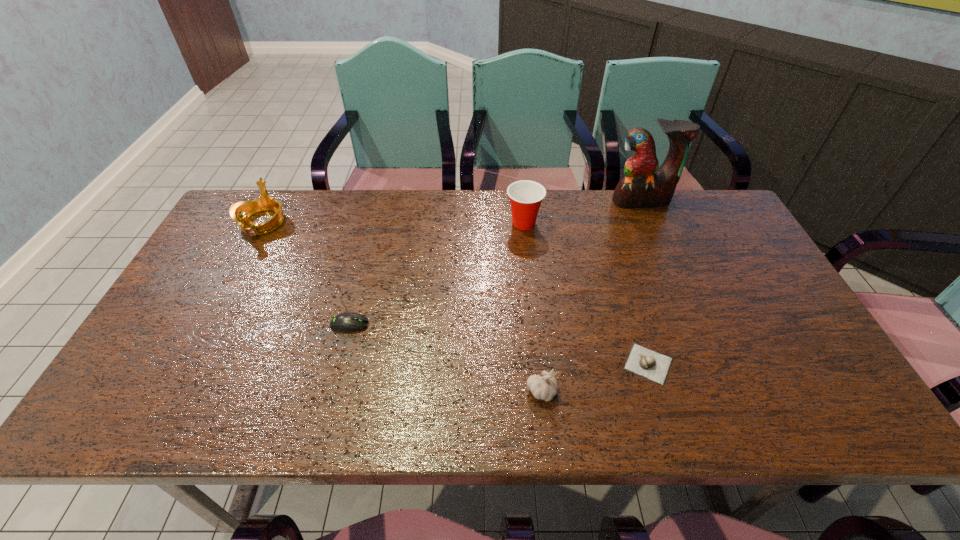
The image size is (960, 540). Find the location of `vacant space located 0.060m on the left of the cup`. vacant space located 0.060m on the left of the cup is located at coordinates (486, 223).

Find the location of a particular element. This screenshot has width=960, height=540. free space located at the front emblem of the leftmost object is located at coordinates (213, 313).

Where is `vacant space situated on the back of the third shortest object`? This screenshot has width=960, height=540. vacant space situated on the back of the third shortest object is located at coordinates (531, 293).

Where is `free space located 0.370m on the wheel side of the third nearest object`? free space located 0.370m on the wheel side of the third nearest object is located at coordinates (516, 325).

Image resolution: width=960 pixels, height=540 pixels. Identify the location of free spot located 0.260m on the left of the shorter garlic. (510, 364).

Identify the location of parrot located at the far edge. The image size is (960, 540). (644, 184).

Find the location of a particular element. The image size is (960, 540). cup present at the far edge is located at coordinates (526, 196).

At what (x,y) coordinates should I click in order to perform the action: click on tiara that is at the far edge. Please return your answer as a coordinate pair (x, y). Looking at the image, I should click on (240, 211).

Find the location of a particular element. The image size is (960, 540). object at the near edge is located at coordinates [545, 387].

Locate an element on the screen. The image size is (960, 540). object located in the left edge section of the desktop is located at coordinates (240, 211).